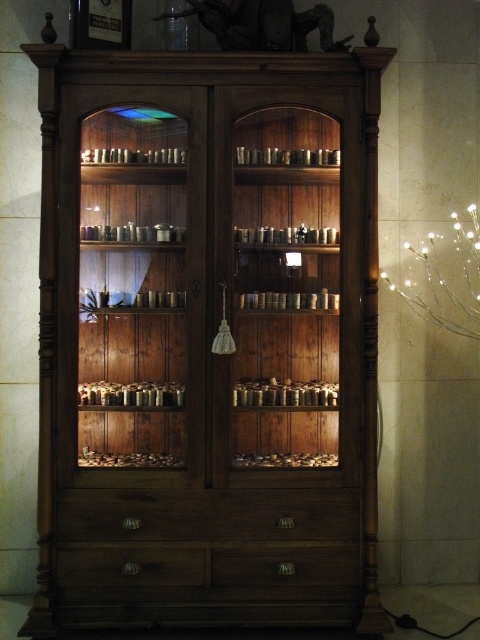
Question: Which point is farther from the camera taking this photo?

Choices:
 (A) pos(131,556)
 (B) pos(181,3)
 (C) pos(352,554)

Answer: (B)

Question: Which point is closer to the camera?

Choices:
 (A) transparent glass jar at upper center
 (B) matte wood drawer at lower center

Answer: (B)

Question: Estimate the real-world distances between objects in this image. Which object is farther from the transparent glass jar at upper center?

Choices:
 (A) matte wood drawer at lower center
 (B) wooden shelves at left

Answer: (A)

Question: Considering the relative positions of wooden shelves at left and matte wood drawer at center in the image provided, where is wooden shelves at left located with respect to matte wood drawer at center?

Choices:
 (A) right
 (B) left

Answer: (B)

Question: Does wooden shelves at left appear over matte wood drawer at lower center?

Choices:
 (A) no
 (B) yes

Answer: (B)

Question: Can you confirm if matte wood drawer at center is smaller than transparent glass jar at upper center?

Choices:
 (A) yes
 (B) no

Answer: (A)